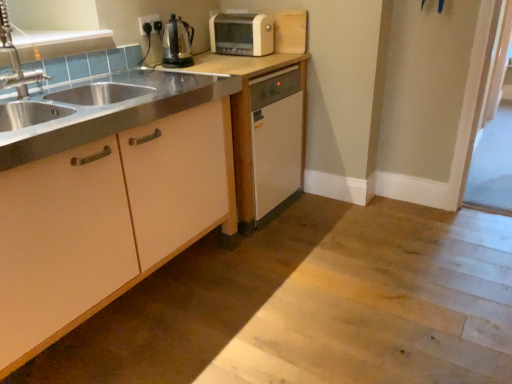
Locate an element on the screen. The height and width of the screenshot is (384, 512). matte white dishwasher at center, acting as the first cabinetry starting from the back is located at coordinates pos(249,116).

What do you see at coordinates (15, 59) in the screenshot?
I see `brushed metal faucet at left` at bounding box center [15, 59].

What do you see at coordinates (242, 34) in the screenshot?
I see `white plastic toaster at upper center` at bounding box center [242, 34].

In order to face shiny metallic kettle at upper center, should I rotate leftwards or rightwards?

It's best to rotate left around 10.479 degrees.

The image size is (512, 384). Describe the element at coordinates (177, 43) in the screenshot. I see `shiny metallic kettle at upper center` at that location.

What do you see at coordinates (147, 21) in the screenshot? I see `black plastic electric outlet at upper center` at bounding box center [147, 21].

This screenshot has height=384, width=512. I want to click on clear glass screen door at right, so click(x=490, y=78).

Where is `matte white cabinet at left, marked as the second cabinetry in a back-to-front arrangement`? matte white cabinet at left, marked as the second cabinetry in a back-to-front arrangement is located at coordinates (106, 222).

Between shiny metallic kettle at upper center and white plastic toaster at upper center, which one has larger size?

white plastic toaster at upper center is bigger.

Consider the image. From the image's perspective, is shiny metallic kettle at upper center positioned above or below white plastic toaster at upper center?

shiny metallic kettle at upper center is situated lower than white plastic toaster at upper center in the image.

Would you say shiny metallic kettle at upper center is inside or outside white plastic toaster at upper center?

The correct answer is: outside.

Is shiny metallic kettle at upper center in front of or behind white plastic toaster at upper center in the image?

In the image, shiny metallic kettle at upper center appears in front of white plastic toaster at upper center.

Which point is more distant from viewer, (x=179, y=54) or (x=249, y=143)?

The point (x=179, y=54) is farther.

Considering the relative sizes of shiny metallic kettle at upper center and matte white dishwasher at center, acting as the first cabinetry starting from the back, in the image provided, is shiny metallic kettle at upper center taller than matte white dishwasher at center, acting as the first cabinetry starting from the back,?

In fact, shiny metallic kettle at upper center may be shorter than matte white dishwasher at center, acting as the first cabinetry starting from the back.

In the scene shown: How different are the orientations of shiny metallic kettle at upper center and matte white dishwasher at center, acting as the first cabinetry starting from the back, in degrees?

The angular difference between shiny metallic kettle at upper center and matte white dishwasher at center, acting as the first cabinetry starting from the back, is 37.8 degrees.

From the picture: Which of these two, shiny metallic kettle at upper center or matte white dishwasher at center, which is the second cabinetry in front-to-back order, is thinner?

With smaller width is shiny metallic kettle at upper center.

Considering the points (187, 64) and (19, 80), which point is in front, point (187, 64) or point (19, 80)?

The point (19, 80) is in front.

Is shiny metallic kettle at upper center to the right of brushed metal faucet at left from the viewer's perspective?

Yes, shiny metallic kettle at upper center is to the right of brushed metal faucet at left.

Is shiny metallic kettle at upper center facing towards brushed metal faucet at left?

No, shiny metallic kettle at upper center is not turned towards brushed metal faucet at left.

Is shiny metallic kettle at upper center positioned before brushed metal faucet at left?

That is False.

Does point (143, 31) come farther from viewer compared to point (234, 157)?

Yes, it is.

The height and width of the screenshot is (384, 512). Find the location of `cabinetry that is the 2nd one below the black plastic electric outlet at upper center (from a real-world perspective)`. cabinetry that is the 2nd one below the black plastic electric outlet at upper center (from a real-world perspective) is located at coordinates (249, 116).

How distant is black plastic electric outlet at upper center from matte white dishwasher at center, which is the second cabinetry in front-to-back order?

black plastic electric outlet at upper center and matte white dishwasher at center, which is the second cabinetry in front-to-back order, are 27.72 inches apart.

From a real-world perspective, which object rests below the other?

matte white dishwasher at center, which is the second cabinetry in front-to-back order.

From a real-world perspective, does black plastic electric outlet at upper center sit lower than brushed metal faucet at left?

No.

Which object is closer to the camera taking this photo, black plastic electric outlet at upper center or brushed metal faucet at left?

brushed metal faucet at left is closer to the camera.

How many degrees apart are the facing directions of black plastic electric outlet at upper center and brushed metal faucet at left?

black plastic electric outlet at upper center and brushed metal faucet at left are facing 40.9 degrees away from each other.

Looking at this image, can you confirm if black plastic electric outlet at upper center is shorter than brushed metal faucet at left?

Correct, black plastic electric outlet at upper center is not as tall as brushed metal faucet at left.

Is matte white cabinet at left, marked as the second cabinetry in a back-to-front arrangement, facing away from black plastic electric outlet at upper center?

matte white cabinet at left, marked as the second cabinetry in a back-to-front arrangement, is not turned away from black plastic electric outlet at upper center.

Which object is positioned more to the right, matte white cabinet at left, marked as the second cabinetry in a back-to-front arrangement, or black plastic electric outlet at upper center?

Positioned to the right is black plastic electric outlet at upper center.

Can you confirm if matte white cabinet at left, placed as the 1th cabinetry when sorted from front to back, is bigger than black plastic electric outlet at upper center?

Yes.

What's the angular difference between matte white cabinet at left, placed as the 1th cabinetry when sorted from front to back, and black plastic electric outlet at upper center's facing directions?

matte white cabinet at left, placed as the 1th cabinetry when sorted from front to back, and black plastic electric outlet at upper center are facing 0.028 degrees away from each other.

Is brushed metal faucet at left positioned far away from clear glass screen door at right?

brushed metal faucet at left is positioned a significant distance from clear glass screen door at right.

Looking at this image, is brushed metal faucet at left positioned with its back to clear glass screen door at right?

brushed metal faucet at left is not turned away from clear glass screen door at right.

Who is more distant, brushed metal faucet at left or clear glass screen door at right?

clear glass screen door at right.

Which object is wider, brushed metal faucet at left or clear glass screen door at right?

brushed metal faucet at left is wider.

Locate an element on the screen. This screenshot has width=512, height=384. kitchen appliance on the left of the white plastic toaster at upper center is located at coordinates (177, 43).

Find the location of a particular element. The image size is (512, 384). the 2nd cabinetry positioned below the shiny metallic kettle at upper center (from a real-world perspective) is located at coordinates (249, 116).

Estimate the real-world distances between objects in this image. Which object is further from shiny metallic kettle at upper center, clear glass screen door at right or brushed metal faucet at left?

clear glass screen door at right lies further to shiny metallic kettle at upper center than the other object.

Based on their spatial positions, is black plastic electric outlet at upper center or clear glass screen door at right further from matte white cabinet at left, marked as the second cabinetry in a back-to-front arrangement?

clear glass screen door at right is further to matte white cabinet at left, marked as the second cabinetry in a back-to-front arrangement.

Based on their spatial positions, is shiny metallic kettle at upper center or clear glass screen door at right closer to matte white dishwasher at center, acting as the first cabinetry starting from the back?

Among the two, shiny metallic kettle at upper center is located nearer to matte white dishwasher at center, acting as the first cabinetry starting from the back.

Based on their spatial positions, is clear glass screen door at right or shiny metallic kettle at upper center closer to matte white dishwasher at center, acting as the first cabinetry starting from the back?

shiny metallic kettle at upper center is closer to matte white dishwasher at center, acting as the first cabinetry starting from the back.

Considering their positions, is matte white dishwasher at center, acting as the first cabinetry starting from the back, positioned closer to black plastic electric outlet at upper center than white plastic toaster at upper center?

Among the two, white plastic toaster at upper center is located nearer to black plastic electric outlet at upper center.

Looking at this image, estimate the real-world distances between objects in this image. Which object is further from white plastic toaster at upper center, matte white dishwasher at center, which is the second cabinetry in front-to-back order, or clear glass screen door at right?

The object further to white plastic toaster at upper center is clear glass screen door at right.

From the image, which object appears to be farther from white plastic toaster at upper center, matte white dishwasher at center, which is the second cabinetry in front-to-back order, or shiny metallic kettle at upper center?

matte white dishwasher at center, which is the second cabinetry in front-to-back order, is further to white plastic toaster at upper center.

Looking at the image, which one is located further to black plastic electric outlet at upper center, clear glass screen door at right or white plastic toaster at upper center?

clear glass screen door at right is further to black plastic electric outlet at upper center.

The height and width of the screenshot is (384, 512). I want to click on tap between matte white cabinet at left, placed as the 1th cabinetry when sorted from front to back, and shiny metallic kettle at upper center, along the z-axis, so click(15, 59).

The height and width of the screenshot is (384, 512). I want to click on electric outlet between matte white cabinet at left, marked as the second cabinetry in a back-to-front arrangement, and white plastic toaster at upper center in the front-back direction, so click(x=147, y=21).

What are the coordinates of `home appliance between shiny metallic kettle at upper center and clear glass screen door at right` in the screenshot? It's located at (242, 34).

Where is `kitchen appliance between black plastic electric outlet at upper center and matte white dishwasher at center, which is the second cabinetry in front-to-back order, in the up-down direction`? The image size is (512, 384). kitchen appliance between black plastic electric outlet at upper center and matte white dishwasher at center, which is the second cabinetry in front-to-back order, in the up-down direction is located at coordinates (177, 43).